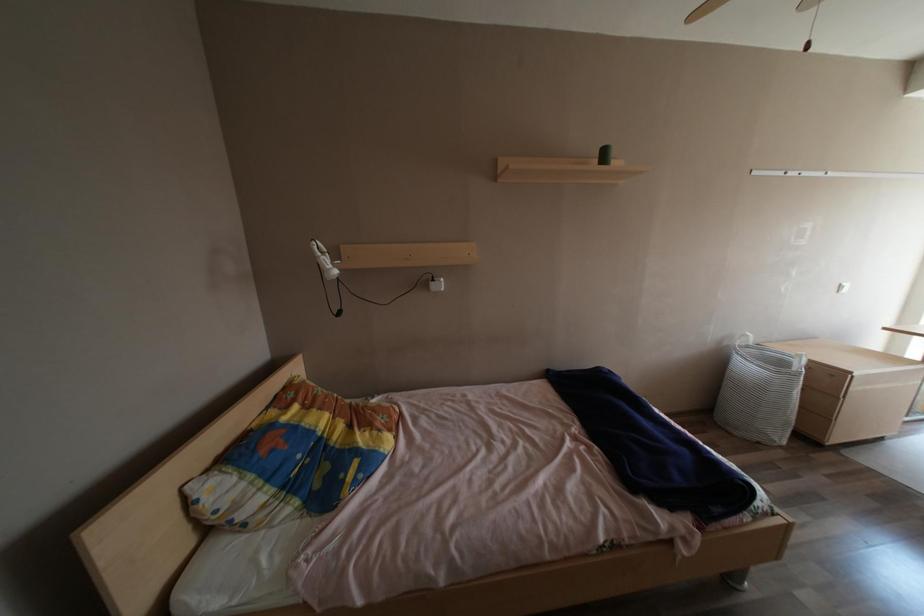
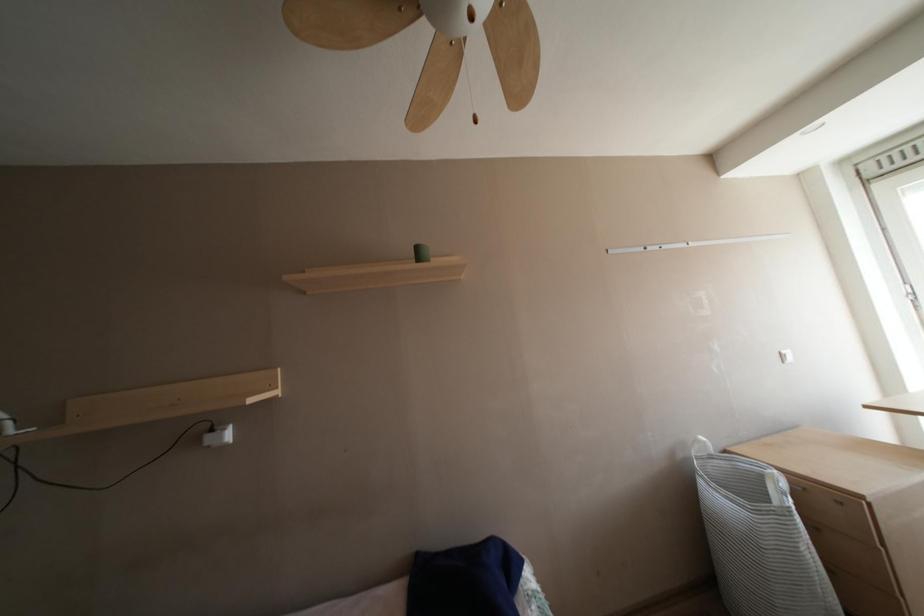
Which direction would the cameraman need to move to produce the second image?

The cameraman walked toward right, forward.